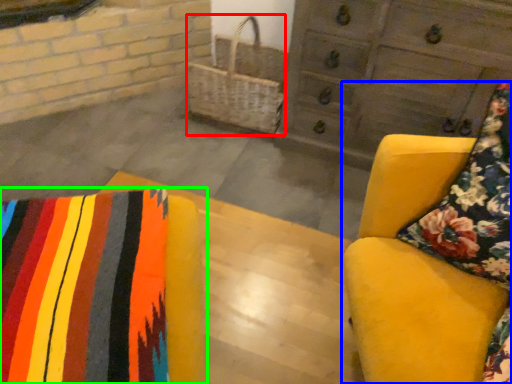
Question: Which is nearer to the basket (highlighted by a red box)? furniture (highlighted by a blue box) or furniture (highlighted by a green box).

Choices:
 (A) furniture
 (B) furniture

Answer: (A)